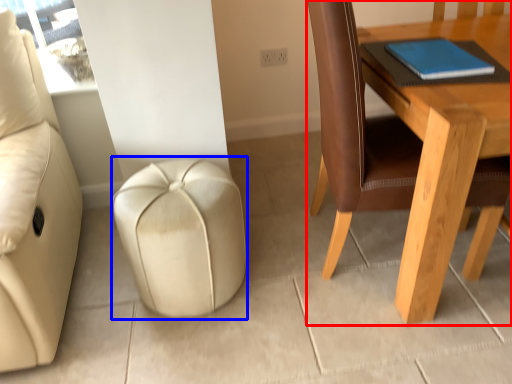
Question: Which object is closer to the camera taking this photo, table (highlighted by a red box) or stool (highlighted by a blue box)?

Choices:
 (A) table
 (B) stool

Answer: (A)